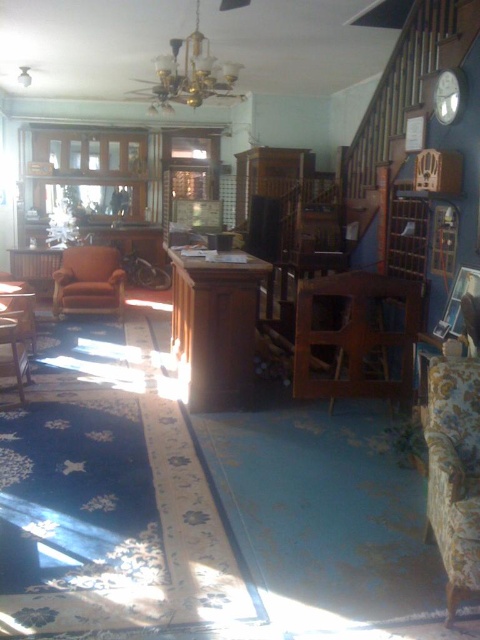
Question: Does floral fabric armchair at lower right appear over leather armchair at center?

Choices:
 (A) yes
 (B) no

Answer: (B)

Question: Which object is positioned farthest from the metallic gold chandelier at upper center?

Choices:
 (A) floral fabric armchair at lower right
 (B) leather armchair at center

Answer: (A)

Question: Does floral fabric armchair at lower right have a larger size compared to metallic gold chandelier at upper center?

Choices:
 (A) no
 (B) yes

Answer: (A)

Question: Is metallic gold chandelier at upper center positioned behind leather armchair at center?

Choices:
 (A) yes
 (B) no

Answer: (B)

Question: Among these objects, which one is farthest from the camera?

Choices:
 (A) metallic gold chandelier at upper center
 (B) floral fabric armchair at lower right
 (C) leather armchair at center

Answer: (C)

Question: Among these points, which one is nearest to the camera?

Choices:
 (A) (163, 72)
 (B) (432, 374)
 (C) (54, 282)

Answer: (B)